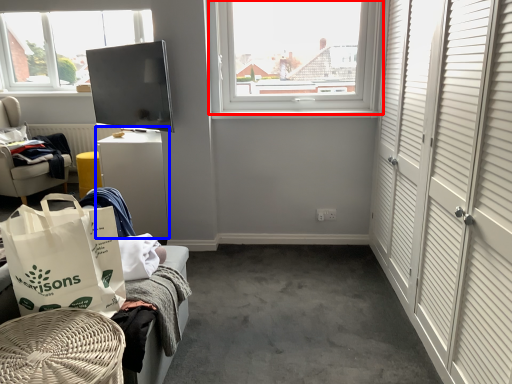
Question: Which object is closer to the camera taking this photo, window (highlighted by a red box) or table (highlighted by a blue box)?

Choices:
 (A) window
 (B) table

Answer: (A)